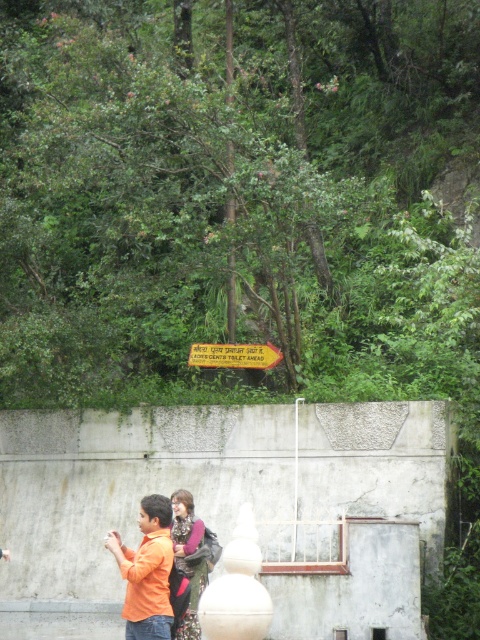
Question: Does orange matte shirt at lower left come behind matte pink sweater at center?

Choices:
 (A) no
 (B) yes

Answer: (A)

Question: Which of these objects is positioned farthest from the matte pink sweater at center?

Choices:
 (A) orange matte shirt at lower left
 (B) metallic yellow arrow at center

Answer: (B)

Question: Which point appears farthest from the camera in this image?

Choices:
 (A) (226, 353)
 (B) (217, 544)
 (C) (169, 541)

Answer: (A)

Question: Among these objects, which one is nearest to the camera?

Choices:
 (A) metallic yellow arrow at center
 (B) orange matte shirt at lower left
 (C) matte pink sweater at center

Answer: (B)

Question: Observing the image, what is the correct spatial positioning of orange matte shirt at lower left in reference to metallic yellow arrow at center?

Choices:
 (A) above
 (B) below

Answer: (B)

Question: Can you confirm if orange matte shirt at lower left is thinner than matte pink sweater at center?

Choices:
 (A) no
 (B) yes

Answer: (A)